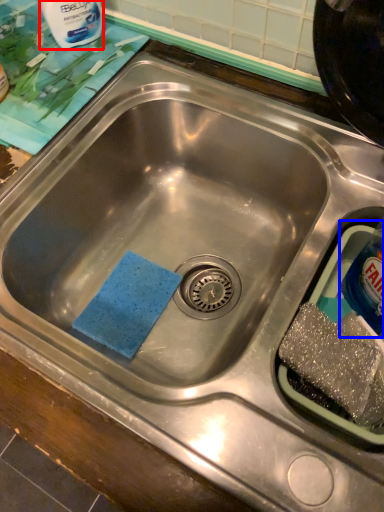
Question: Which object is further to the camera taking this photo, cleaning product (highlighted by a red box) or bottle (highlighted by a blue box)?

Choices:
 (A) cleaning product
 (B) bottle

Answer: (A)